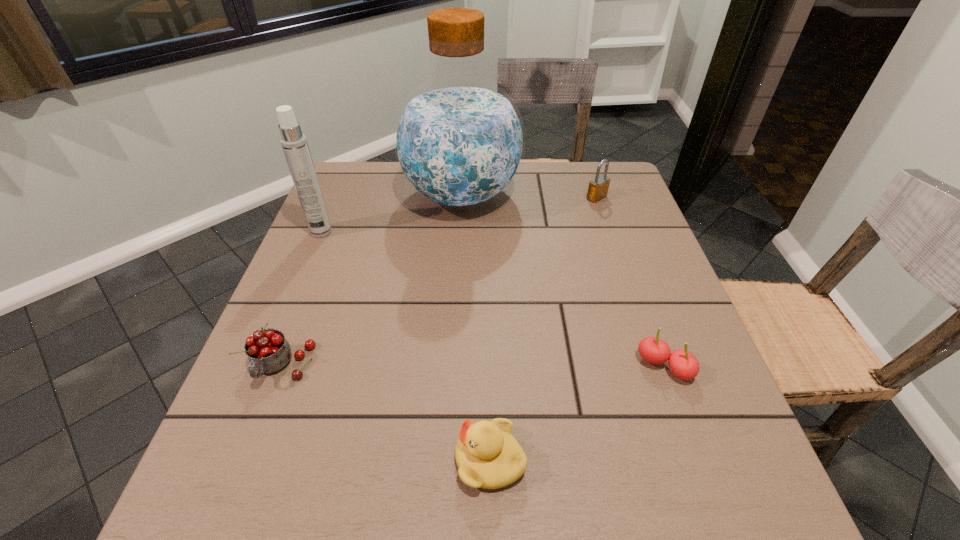
Find the location of a particular element. vacant point located between the shorter cherry and the padlock is located at coordinates (631, 282).

The image size is (960, 540). I want to click on empty location between the duckling and the taller cherry, so click(x=386, y=413).

Locate an element on the screen. This screenshot has height=540, width=960. empty space that is in between the tallest object and the taller cherry is located at coordinates (372, 281).

You are a GUI agent. You are given a task and a screenshot of the screen. Output one action in this format:
    pyautogui.click(x=<x>, y=<y>)
    Task: Click on the empty location between the water jug and the second tallest object
    Image resolution: width=960 pixels, height=540 pixels.
    Given the screenshot: What is the action you would take?
    pyautogui.click(x=392, y=214)

Identify the location of vacant area that lies between the fifth shortest object and the tallest object. This screenshot has width=960, height=540. (392, 214).

Where is `free space between the padlock and the water jug`? The image size is (960, 540). free space between the padlock and the water jug is located at coordinates (529, 197).

At what (x,y) coordinates should I click in order to perform the action: click on vacant region between the right cherry and the water jug. Please return your answer as a coordinate pair (x, y). The height and width of the screenshot is (540, 960). Looking at the image, I should click on (563, 281).

At what (x,y) coordinates should I click in order to perform the action: click on blank region between the padlock and the tallest object. Please return your answer as a coordinate pair (x, y). The image size is (960, 540). Looking at the image, I should click on (529, 197).

Where is `free space that is in between the right cherry and the duckling`? The image size is (960, 540). free space that is in between the right cherry and the duckling is located at coordinates pos(577,413).

Find the location of `object that stands as the fifth closest to the aerosol can`. object that stands as the fifth closest to the aerosol can is located at coordinates (683, 364).